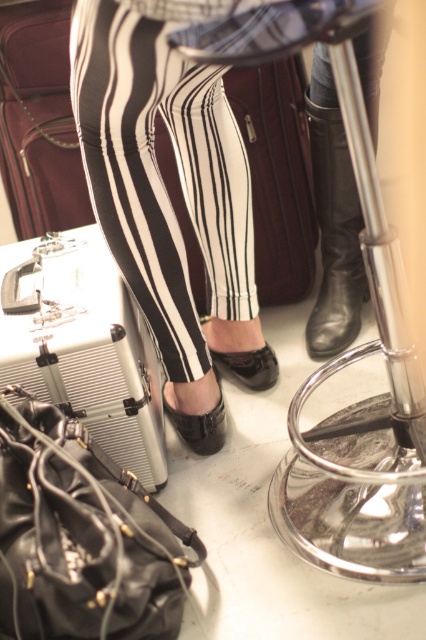
Question: Considering the relative positions of black and white striped leggings at center and black leather suitcase at center in the image provided, where is black and white striped leggings at center located with respect to black leather suitcase at center?

Choices:
 (A) above
 (B) below

Answer: (B)

Question: Which point is closer to the camera?

Choices:
 (A) silver metallic case at lower left
 (B) black and white striped leggings at center
 (C) black leather shoe at lower center

Answer: (B)

Question: Which of the following is the farthest from the observer?

Choices:
 (A) shiny metallic bar stool at center
 (B) black leather bag at lower left

Answer: (B)

Question: Does matte brown suitcase at left lie behind black leather sandal at center?

Choices:
 (A) yes
 (B) no

Answer: (B)

Question: Estimate the real-world distances between objects in this image. Which object is farther from the black leather sandal at center?

Choices:
 (A) black and white striped leggings at center
 (B) black leather shoe at lower center
 (C) shiny metallic bar stool at center

Answer: (C)

Question: Can you confirm if black and white striped leggings at center is positioned to the left of black leather bag at lower left?

Choices:
 (A) no
 (B) yes

Answer: (A)